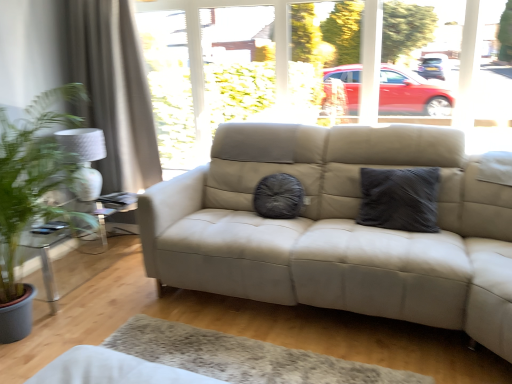
Describe the element at coordinates (114, 91) in the screenshot. This screenshot has height=384, width=512. I see `white textured curtain at left` at that location.

In order to face transparent glass window at center, should I rotate leftwards or rightwards?

A 8.012 degree turn to the right will do.

The image size is (512, 384). What do you see at coordinates (77, 250) in the screenshot?
I see `clear glass table at left` at bounding box center [77, 250].

This screenshot has height=384, width=512. Find the location of `clear glass table at left`. clear glass table at left is located at coordinates (77, 250).

Where is `dark grey textured pillow at center`? This screenshot has width=512, height=384. dark grey textured pillow at center is located at coordinates (399, 199).

Considering the sizes of white textured curtain at left and transparent glass window at center in the image, is white textured curtain at left wider or thinner than transparent glass window at center?

Considering their sizes, white textured curtain at left looks slimmer than transparent glass window at center.

Does white textured curtain at left lie in front of transparent glass window at center?

No, it is behind transparent glass window at center.

Considering the points (70, 17) and (236, 87), which point is behind, point (70, 17) or point (236, 87)?

The point (236, 87) is behind.

In the scene shown: Measure the distance from clear glass table at left to transparent glass window at center.

They are 1.28 meters apart.

From a real-world perspective, which object stands above the other?

transparent glass window at center, from a real-world perspective.

Between clear glass table at left and transparent glass window at center, which one has larger width?

With larger width is clear glass table at left.

How many degrees apart are the facing directions of clear glass table at left and transparent glass window at center?

The facing directions of clear glass table at left and transparent glass window at center are 92.2 degrees apart.

Is dark grey textured pillow at center next to clear glass table at left?

No, dark grey textured pillow at center is not with clear glass table at left.

Is dark grey textured pillow at center wider than clear glass table at left?

Incorrect, the width of dark grey textured pillow at center does not surpass that of clear glass table at left.

Is dark grey textured pillow at center outside of clear glass table at left?

dark grey textured pillow at center is positioned outside clear glass table at left.

Between dark grey textured pillow at center and clear glass table at left, which one is positioned in front?

dark grey textured pillow at center is more forward.

Considering the positions of objects white textured curtain at left and clear glass table at left in the image provided, who is more to the right, white textured curtain at left or clear glass table at left?

From the viewer's perspective, white textured curtain at left appears more on the right side.

Is clear glass table at left surrounded by white textured curtain at left?

No, clear glass table at left is not a part of white textured curtain at left.

Who is shorter, white textured curtain at left or clear glass table at left?

Standing shorter between the two is clear glass table at left.

Considering the relative sizes of transparent glass window at center and dark grey textured pillow at center in the image provided, is transparent glass window at center thinner than dark grey textured pillow at center?

No, transparent glass window at center is not thinner than dark grey textured pillow at center.

Identify the location of pillow that appears on the right of transparent glass window at center. This screenshot has height=384, width=512. (399, 199).

Is transparent glass window at center placed right next to dark grey textured pillow at center?

No, transparent glass window at center is not with dark grey textured pillow at center.

Does clear glass table at left have a smaller size compared to white textured curtain at left?

Indeed, clear glass table at left has a smaller size compared to white textured curtain at left.

How far apart are clear glass table at left and white textured curtain at left?

clear glass table at left is 26.83 inches away from white textured curtain at left.

This screenshot has height=384, width=512. What are the coordinates of `table in front of the white textured curtain at left` in the screenshot? It's located at (77, 250).

In the image, is clear glass table at left positioned in front of or behind white textured curtain at left?

Visually, clear glass table at left is located in front of white textured curtain at left.

Between dark grey textured pillow at center and white textured curtain at left, which one has larger width?

With larger width is white textured curtain at left.

From a real-world perspective, which object stands above the other?

white textured curtain at left is physically above.

Find the location of a particular element. curtain on the left of dark grey textured pillow at center is located at coordinates (114, 91).

In the scene shown: Which is more to the right, dark grey textured pillow at center or white textured curtain at left?

Positioned to the right is dark grey textured pillow at center.

I want to click on curtain located on the left of transparent glass window at center, so click(x=114, y=91).

The height and width of the screenshot is (384, 512). What are the coordinates of `table that is behind the transparent glass window at center` in the screenshot? It's located at (77, 250).

Which object lies nearer to the anchor point dark grey textured pillow at center, white textured curtain at left or transparent glass window at center?

Among the two, transparent glass window at center is located nearer to dark grey textured pillow at center.

Based on the photo, considering their positions, is clear glass table at left positioned further to white textured curtain at left than dark grey textured pillow at center?

dark grey textured pillow at center.

When comparing their distances from dark grey textured pillow at center, does clear glass table at left or transparent glass window at center seem further?

clear glass table at left.

When comparing their distances from dark grey textured pillow at center, does white textured curtain at left or clear glass table at left seem further?

clear glass table at left lies further to dark grey textured pillow at center than the other object.

Looking at the image, which one is located closer to white textured curtain at left, transparent glass window at center or dark grey textured pillow at center?

Based on the image, transparent glass window at center appears to be nearer to white textured curtain at left.

Consider the image. Considering their positions, is dark grey textured pillow at center positioned closer to clear glass table at left than white textured curtain at left?

The object closer to clear glass table at left is white textured curtain at left.

Which object lies further to the anchor point clear glass table at left, white textured curtain at left or dark grey textured pillow at center?

dark grey textured pillow at center is positioned further to the anchor clear glass table at left.

From the image, which object appears to be farther from transparent glass window at center, dark grey textured pillow at center or white textured curtain at left?

Among the two, dark grey textured pillow at center is located further to transparent glass window at center.

At what (x,y) coordinates should I click in order to perform the action: click on curtain between clear glass table at left and dark grey textured pillow at center from left to right. Please return your answer as a coordinate pair (x, y). This screenshot has width=512, height=384. Looking at the image, I should click on (114, 91).

Where is `window frame between white textured curtain at left and dark grey textured pillow at center in the horizontal direction`? The width and height of the screenshot is (512, 384). window frame between white textured curtain at left and dark grey textured pillow at center in the horizontal direction is located at coordinates (300, 67).

Locate an element on the screen. This screenshot has height=384, width=512. window frame between clear glass table at left and dark grey textured pillow at center from left to right is located at coordinates (300, 67).

The height and width of the screenshot is (384, 512). I want to click on curtain between clear glass table at left and transparent glass window at center from left to right, so click(114, 91).